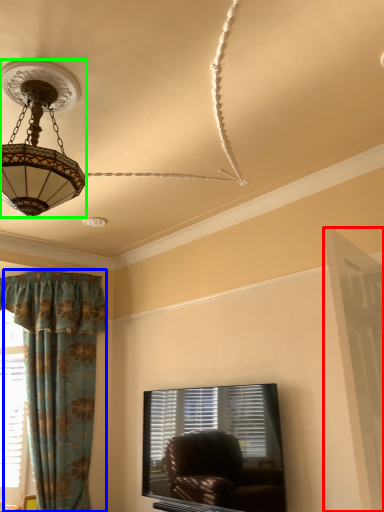
Question: Which object is positioned farthest from screen door (highlighted by a red box)? Select from curtain (highlighted by a blue box) and lamp (highlighted by a green box).

Choices:
 (A) curtain
 (B) lamp

Answer: (A)